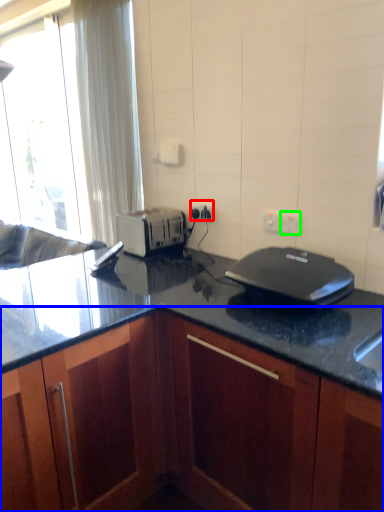
Question: Which is farther away from electric outlet (highlighted by a red box)? cabinetry (highlighted by a blue box) or electric outlet (highlighted by a green box)?

Choices:
 (A) cabinetry
 (B) electric outlet

Answer: (A)